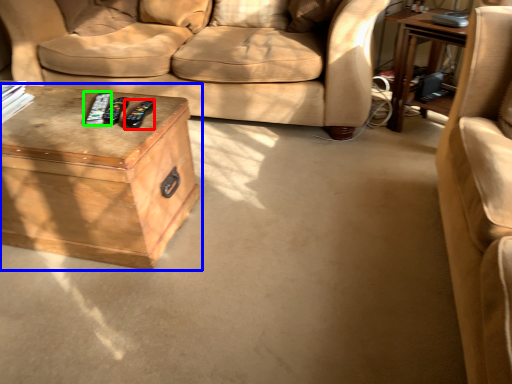
Question: Which is farther away from remote (highlighted by a red box)? table (highlighted by a blue box) or remote (highlighted by a green box)?

Choices:
 (A) table
 (B) remote

Answer: (A)